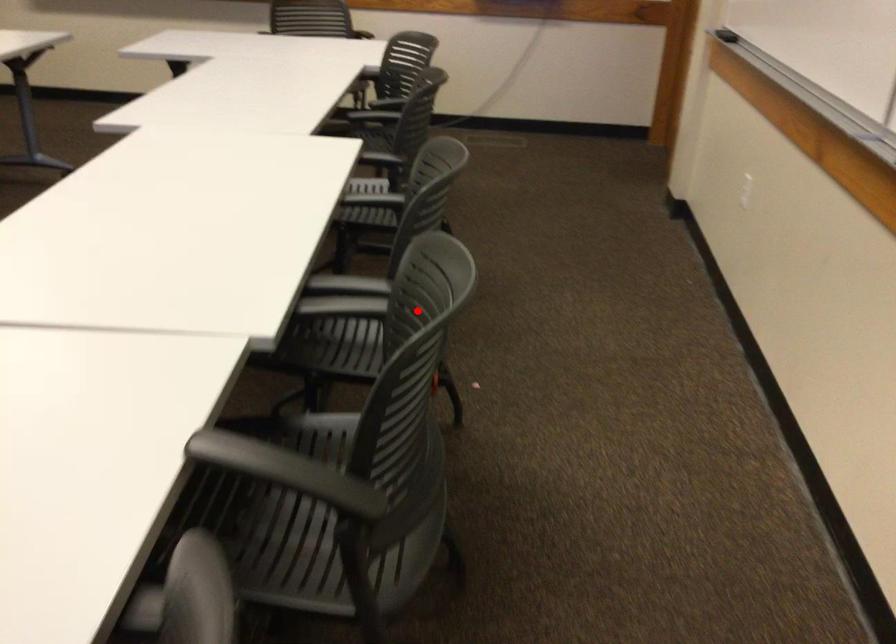
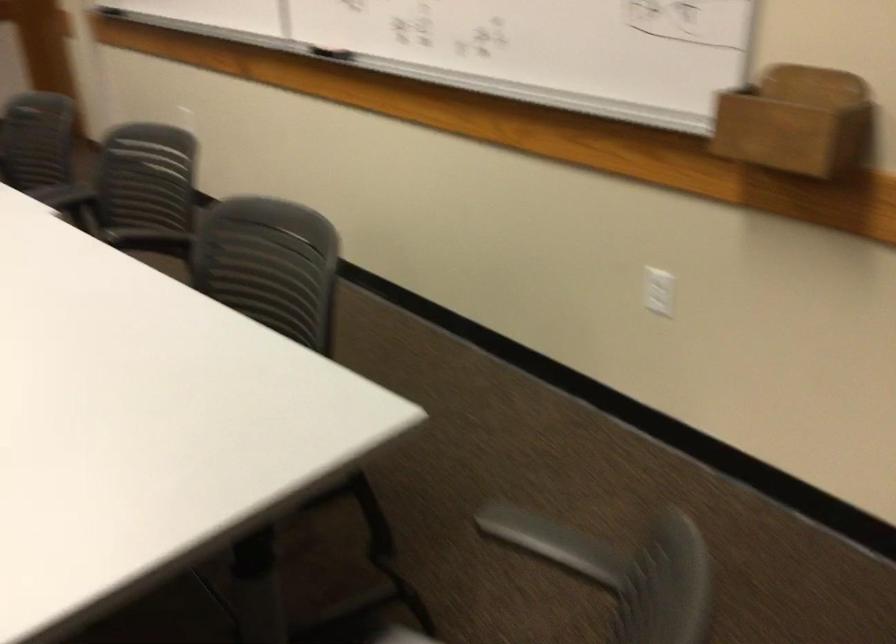
Where in the second image is the point corresponding to the highlighted location from the first image?

(144, 178)